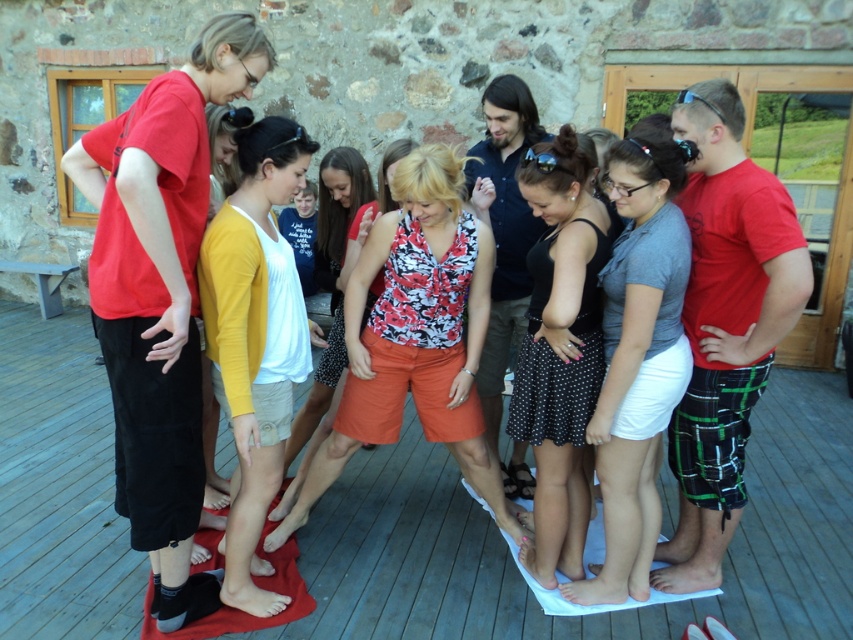
Can you confirm if black dotted skirt at center is taller than floral print blouse at center?

Correct, black dotted skirt at center is much taller as floral print blouse at center.

Does black dotted skirt at center have a lesser height compared to floral print blouse at center?

In fact, black dotted skirt at center may be taller than floral print blouse at center.

Describe the element at coordinates (560, 348) in the screenshot. The image size is (853, 640). I see `black dotted skirt at center` at that location.

I want to click on black dotted skirt at center, so click(x=560, y=348).

Which is below, yellow cotton cardigan at center or floral print blouse at center?

yellow cotton cardigan at center is lower down.

Who is higher up, yellow cotton cardigan at center or floral print blouse at center?

floral print blouse at center

Locate an element on the screen. Image resolution: width=853 pixels, height=640 pixels. yellow cotton cardigan at center is located at coordinates (256, 337).

Is matte red shirt at left shorter than gray matte skirt at center?

In fact, matte red shirt at left may be taller than gray matte skirt at center.

Which is above, matte red shirt at left or gray matte skirt at center?

Positioned higher is matte red shirt at left.

Is point (144, 508) behind point (640, 548)?

No.

Image resolution: width=853 pixels, height=640 pixels. I want to click on matte red shirt at left, so click(x=160, y=296).